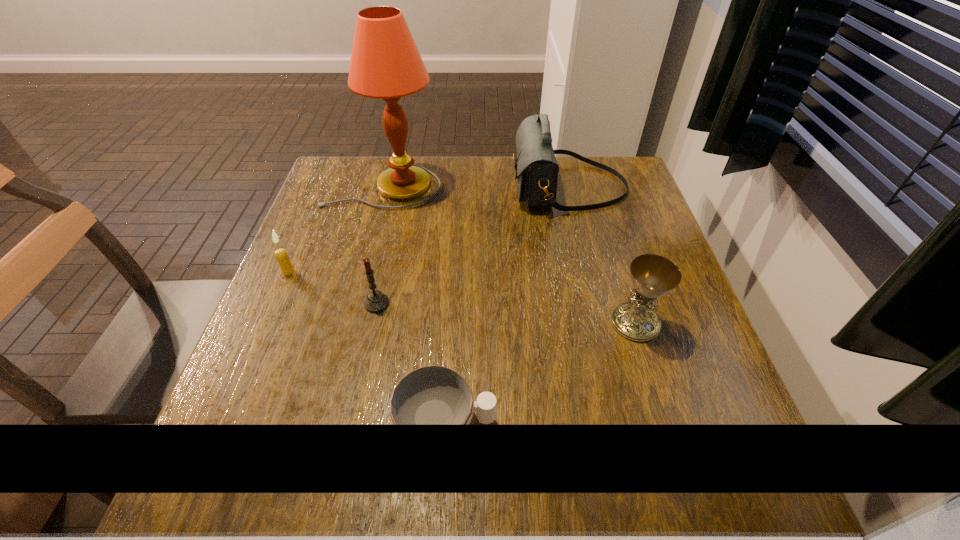
Locate which object ranks fourth in proximity to the nearest object. Please provide its 2D coordinates. Your answer should be formatted as a tuple, i.e. [(x, y)], where the tuple contains the x and y coordinates of a point satisfying the conditions above.

[(536, 167)]

Find the location of a particular element. free point that satisfies the following two spatial constraints: 1. on the back side of the shoulder bag; 2. on the left side of the nearer candle is located at coordinates (402, 186).

The width and height of the screenshot is (960, 540). What are the coordinates of `vacant space that satisfies the following two spatial constraints: 1. on the back side of the farther candle; 2. on the left side of the tallest object` in the screenshot? It's located at (324, 186).

Where is `vacant space that satisfies the following two spatial constraints: 1. on the back side of the shoulder bag; 2. on the right side of the tallest object`? vacant space that satisfies the following two spatial constraints: 1. on the back side of the shoulder bag; 2. on the right side of the tallest object is located at coordinates (383, 186).

Where is `vacant point that satisfies the following two spatial constraints: 1. on the back side of the right candle; 2. on the left side of the fifth shortest object`? The width and height of the screenshot is (960, 540). vacant point that satisfies the following two spatial constraints: 1. on the back side of the right candle; 2. on the left side of the fifth shortest object is located at coordinates (402, 186).